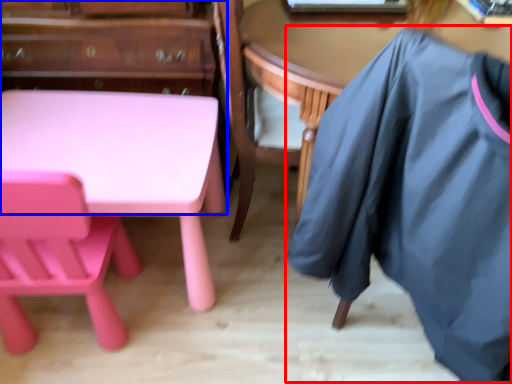
Question: Which object appears closest to the camera in this image, clothing (highlighted by a red box) or dresser (highlighted by a blue box)?

Choices:
 (A) clothing
 (B) dresser

Answer: (A)